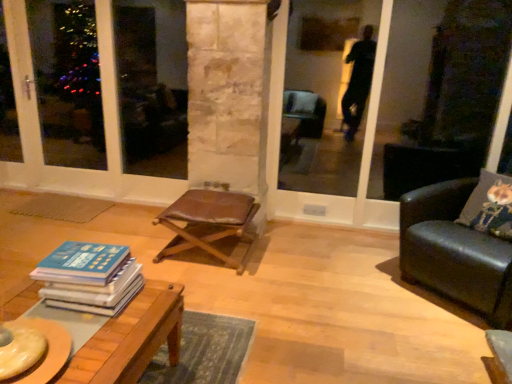
Locate an element on the screen. The image size is (512, 384). free space in front of white glass screen door at left is located at coordinates (67, 228).